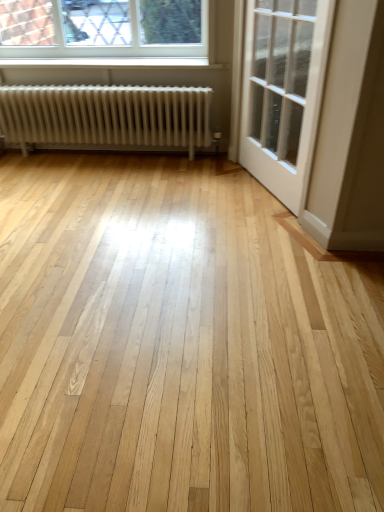
The image size is (384, 512). In order to click on free location to the left of white glossy door at upper right in this screenshot , I will do `click(201, 194)`.